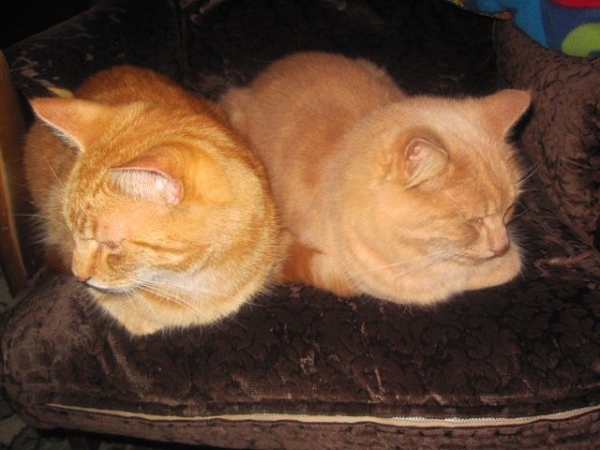
Where is `chair`? This screenshot has height=450, width=600. chair is located at coordinates (332, 336).